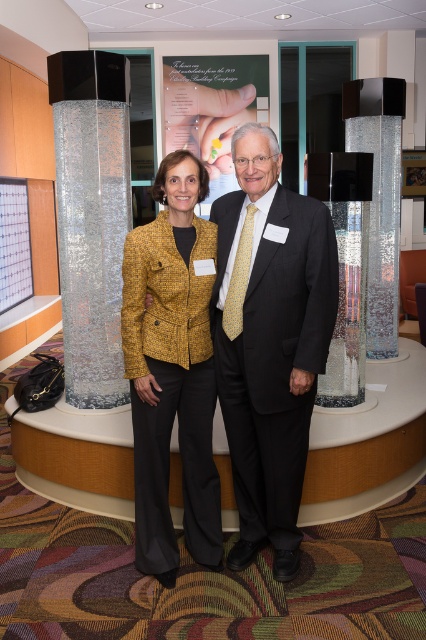
You are a photographer standing at the camera position. You want to take a closeup photo of the yellow textured blazer at center. The camera has a minimum focusing distance of 1.5 meters. Can you take the photo without moving closer?

The distance between the yellow textured blazer at center and the camera is 2.13 meters, which is greater than the minimum focusing distance of 1.5 meters. Therefore, you can take the closeup photo without moving closer.

You are standing in front of the two people and the column in the image. Which object is positioned lower between the black suit at center and the sparkly silver column at center?

The black suit at center is located below the sparkly silver column at center, so the black suit at center is positioned lower.